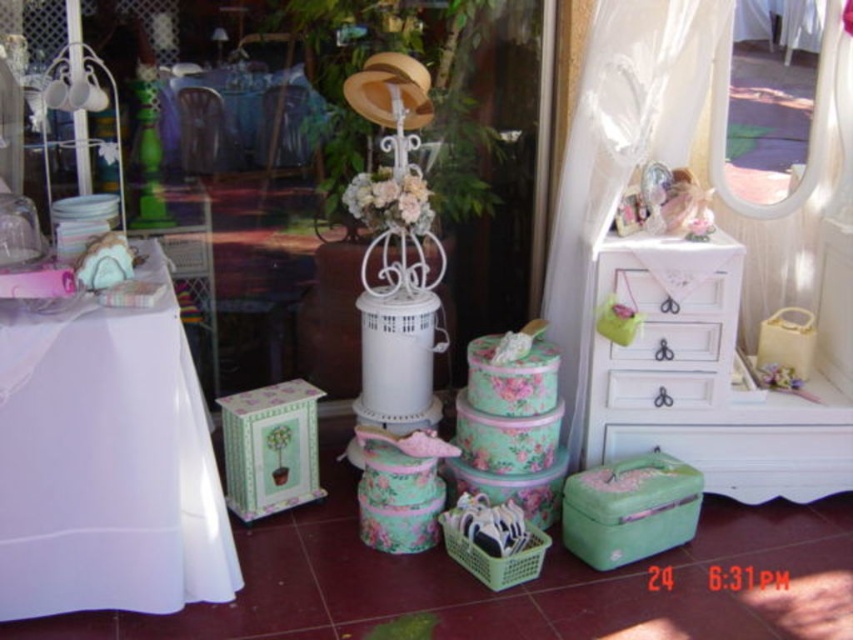
Question: Which is nearer to the transparent glass door at center?

Choices:
 (A) white painted wood dresser at right
 (B) white fabric table at left

Answer: (A)

Question: Which of the following is the farthest from the observer?

Choices:
 (A) white painted wood dresser at right
 (B) white painted wood drawers at right
 (C) clear plastic mirror at upper right
 (D) green matte drawer at center

Answer: (D)

Question: Which point is farther from the camera taking this photo?

Choices:
 (A) (636, 404)
 (B) (25, 595)

Answer: (A)

Question: Does white painted wood dresser at right appear on the left side of clear plastic mirror at upper right?

Choices:
 (A) no
 (B) yes

Answer: (B)

Question: Is white fabric table at left below white painted wood drawers at right?

Choices:
 (A) yes
 (B) no

Answer: (A)

Question: Is white painted wood dresser at right to the right of transparent glass door at center from the viewer's perspective?

Choices:
 (A) no
 (B) yes

Answer: (B)